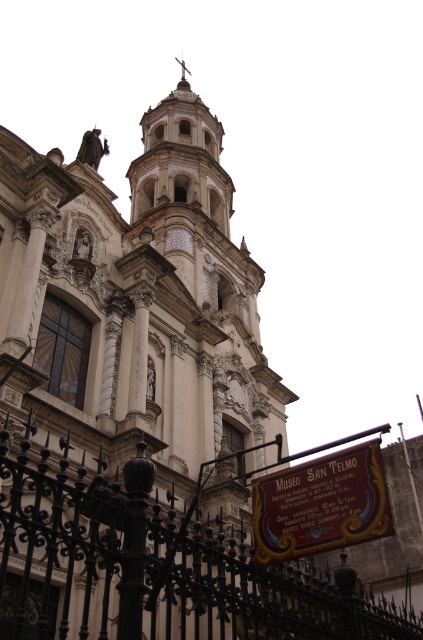
Is black wrought iron fence at lower center positioned in front of wooden signboard at center?

Yes, it is.

Does point (389, 612) lie in front of point (321, 522)?

No, it is behind (321, 522).

Who is more forward, (8, 508) or (277, 540)?

Point (277, 540) is in front.

The width and height of the screenshot is (423, 640). Identify the location of black wrought iron fence at lower center. (153, 564).